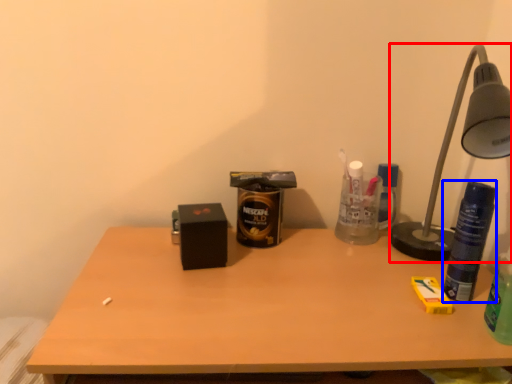
Question: Which of the following is the farthest to the observer, lamp (highlighted by a red box) or beverage (highlighted by a blue box)?

Choices:
 (A) lamp
 (B) beverage

Answer: (B)